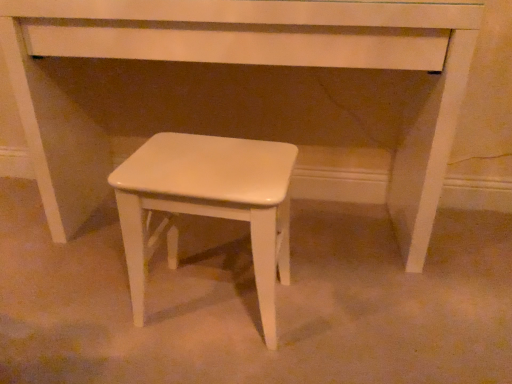
Question: From a real-world perspective, is white matte stool at center above or below white matte stool at center?

Choices:
 (A) above
 (B) below

Answer: (B)

Question: Would you say white matte stool at center is inside or outside white matte stool at center?

Choices:
 (A) outside
 (B) inside

Answer: (A)

Question: In terms of height, does white matte stool at center look taller or shorter compared to white matte stool at center?

Choices:
 (A) tall
 (B) short

Answer: (B)

Question: Considering the positions of white matte stool at center and white matte stool at center in the image, is white matte stool at center taller or shorter than white matte stool at center?

Choices:
 (A) tall
 (B) short

Answer: (A)

Question: Visually, is white matte stool at center positioned to the left or to the right of white matte stool at center?

Choices:
 (A) right
 (B) left

Answer: (A)

Question: Does point (168, 44) appear closer or farther from the camera than point (272, 213)?

Choices:
 (A) closer
 (B) farther

Answer: (B)

Question: Considering their positions, is white matte stool at center located in front of or behind white matte stool at center?

Choices:
 (A) front
 (B) behind

Answer: (B)